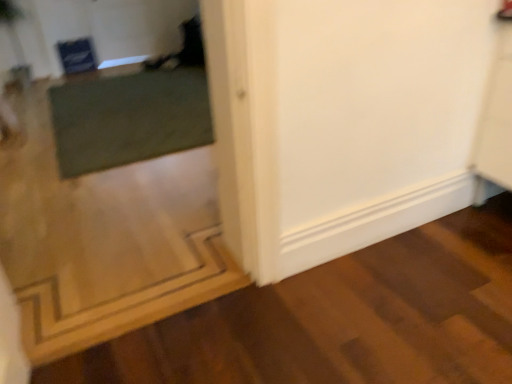
The height and width of the screenshot is (384, 512). Find the location of `green fabric mat at center`. green fabric mat at center is located at coordinates (129, 118).

What do you see at coordinates (129, 118) in the screenshot?
I see `green fabric mat at center` at bounding box center [129, 118].

Where is `green fabric mat at center`? green fabric mat at center is located at coordinates (129, 118).